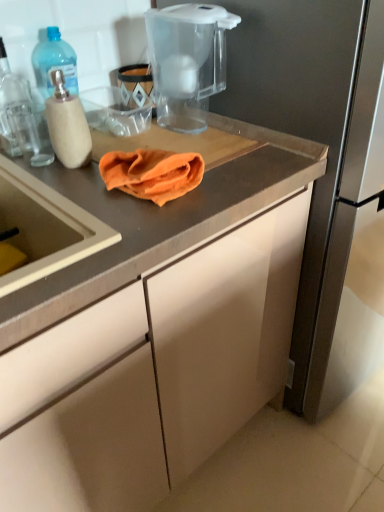
I want to click on free space on the front side of transparent plastic water filter pitcher at upper center, so click(x=208, y=147).